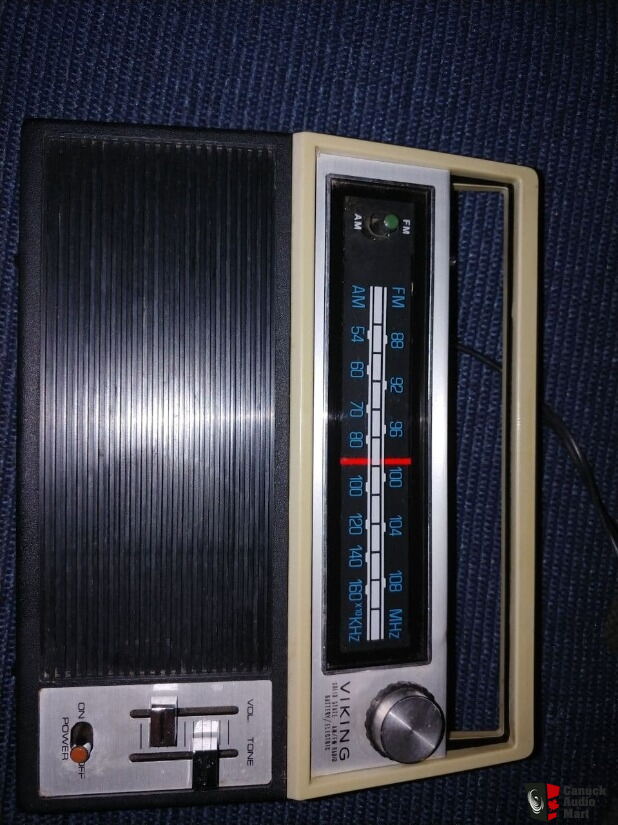
This screenshot has width=618, height=825. Find the location of `volume slider`. volume slider is located at coordinates (159, 724).